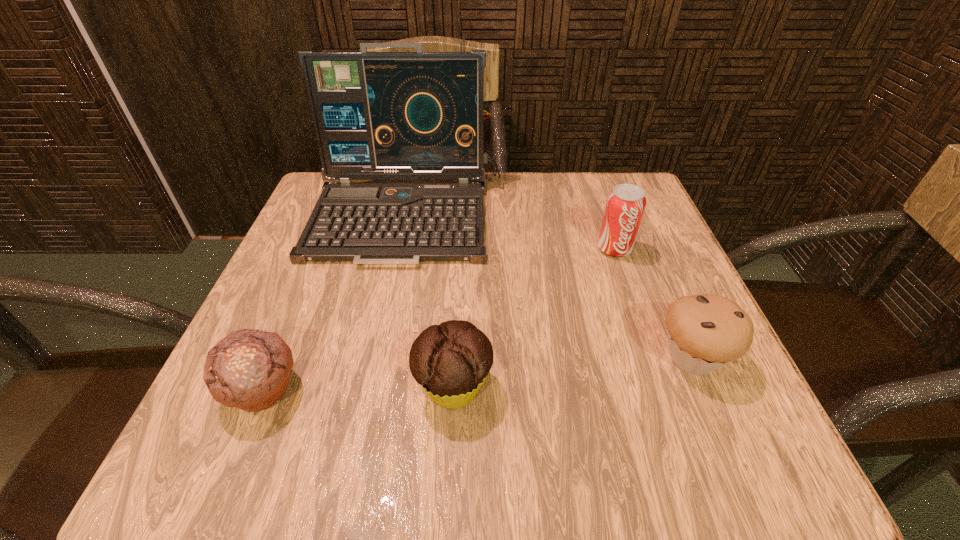
The width and height of the screenshot is (960, 540). What are the coordinates of `object positioned at the far edge` in the screenshot? It's located at (418, 115).

At what (x,y) coordinates should I click in order to perform the action: click on laptop computer at the left edge. Please return your answer as a coordinate pair (x, y). Image resolution: width=960 pixels, height=540 pixels. Looking at the image, I should click on (418, 115).

The image size is (960, 540). Identify the location of muffin located at the left edge. (249, 369).

Find the location of a particular element. This screenshot has width=960, height=540. soda can that is positioned at the right edge is located at coordinates (625, 205).

In order to click on muffin that is at the right edge in this screenshot , I will do `click(705, 332)`.

Find the location of a particular element. This screenshot has height=540, width=960. object that is at the far left corner is located at coordinates pos(418,115).

Identify the location of object located in the near left corner section of the desktop. (249, 369).

In the image, there is a desktop. Where is `vacant space at the far edge`? Image resolution: width=960 pixels, height=540 pixels. vacant space at the far edge is located at coordinates (501, 193).

You are a GUI agent. You are given a task and a screenshot of the screen. Output one action in this format:
    pyautogui.click(x=<x>, y=<y>)
    Task: Click on the free region at the near edge of the desktop
    
    Given the screenshot: What is the action you would take?
    pyautogui.click(x=440, y=455)

You are a GUI agent. You are given a task and a screenshot of the screen. Output one action in this format:
    pyautogui.click(x=<x>, y=<y>)
    Task: Click on the blank space at the left edge
    This screenshot has height=540, width=960.
    Given the screenshot: What is the action you would take?
    pyautogui.click(x=293, y=282)